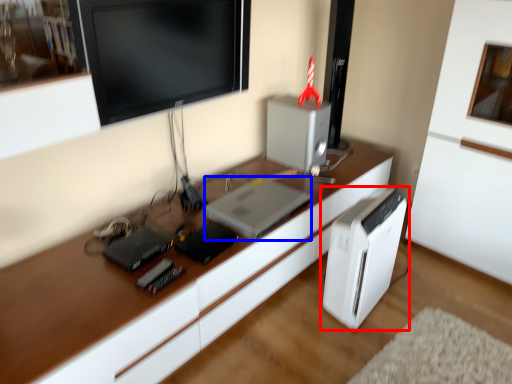
Question: Among these objects, which one is nearest to the camera, home appliance (highlighted by a red box) or computer (highlighted by a blue box)?

Choices:
 (A) home appliance
 (B) computer

Answer: (A)